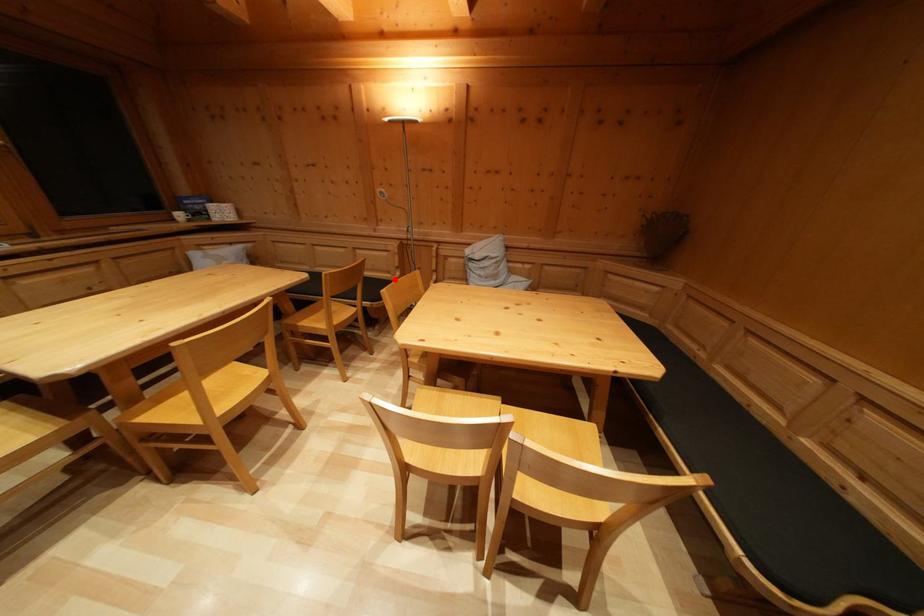
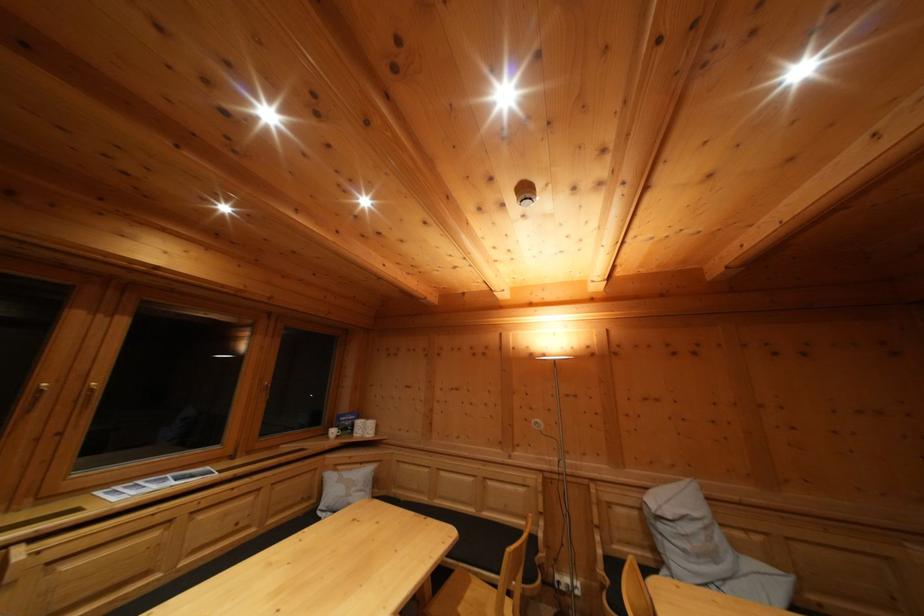
Question: I am providing you with two images of the same scene from different viewpoints. A red point is marked on the first image. Is the red point's position out of view in image 2?

Choices:
 (A) Yes
 (B) No

Answer: (B)